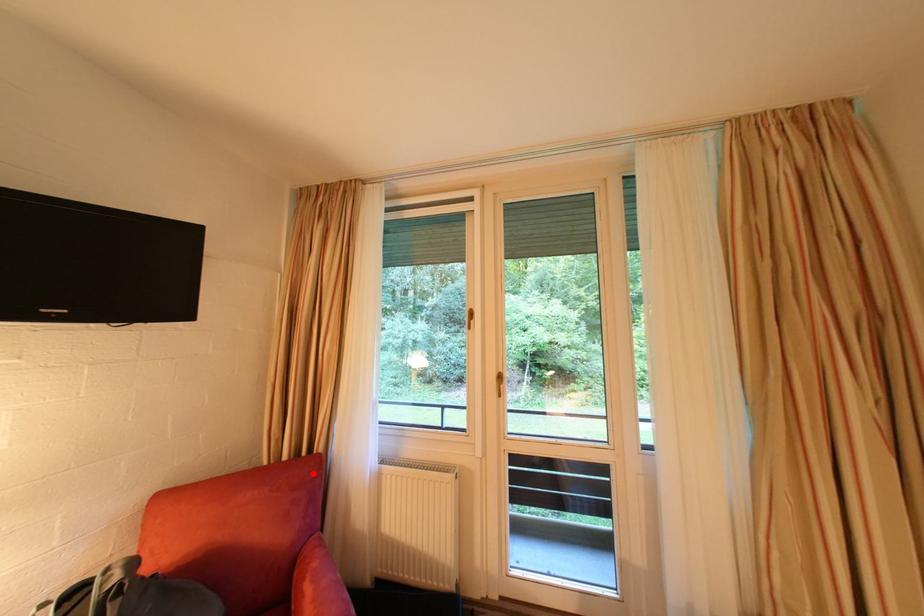
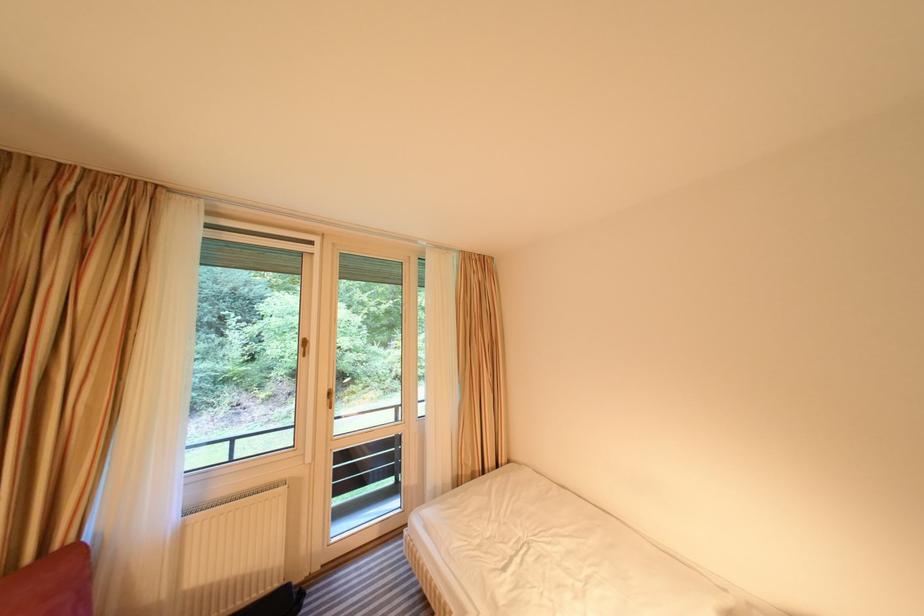
Question: I am providing you with two images of the same scene from different viewpoints. A red point is marked on the first image. Is the red point's position out of view in image 2?

Choices:
 (A) Yes
 (B) No

Answer: (B)